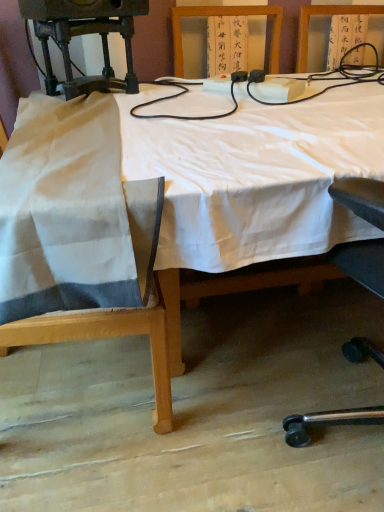
Question: In the image, is white fabric chair at left positioned in front of or behind white cloth-covered table at center?

Choices:
 (A) behind
 (B) front

Answer: (A)

Question: From their relative heights in the image, would you say white fabric chair at left is taller or shorter than white cloth-covered table at center?

Choices:
 (A) short
 (B) tall

Answer: (B)

Question: Is white fabric chair at left wider or thinner than white cloth-covered table at center?

Choices:
 (A) wide
 (B) thin

Answer: (B)

Question: From their relative heights in the image, would you say white cloth-covered table at center is taller or shorter than white fabric chair at left?

Choices:
 (A) tall
 (B) short

Answer: (B)

Question: Does point (377, 108) appear closer or farther from the camera than point (144, 287)?

Choices:
 (A) closer
 (B) farther

Answer: (B)

Question: In terms of size, does white cloth-covered table at center appear bigger or smaller than white fabric chair at left?

Choices:
 (A) small
 (B) big

Answer: (B)

Question: From a real-world perspective, is white cloth-covered table at center physically located above or below white fabric chair at left?

Choices:
 (A) above
 (B) below

Answer: (B)